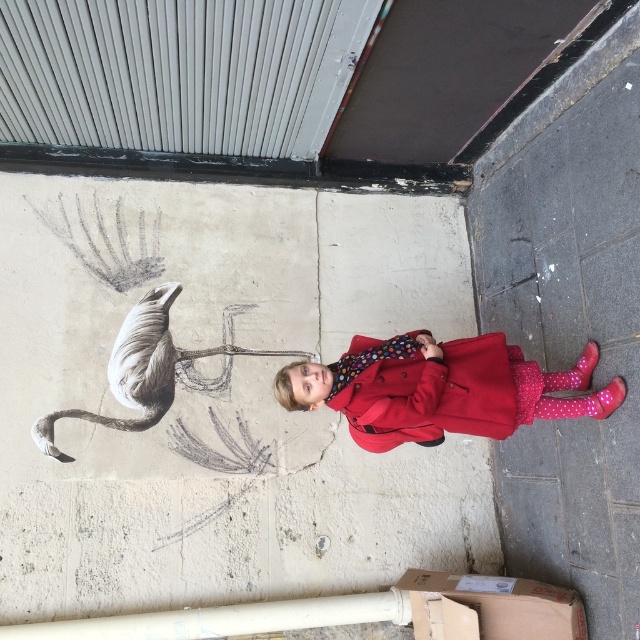
Is point (540, 355) more distant than point (330, 378)?

Yes, point (540, 355) is farther from viewer.

Is gray concrete sidewalk at lower right bigger than matte red coat at center?

Yes, gray concrete sidewalk at lower right is bigger than matte red coat at center.

Find the location of a particular element. The height and width of the screenshot is (640, 640). gray concrete sidewalk at lower right is located at coordinates (570, 321).

Measure the distance between smooth concrete wall at center and matte red coat at center.

smooth concrete wall at center and matte red coat at center are 31.65 inches apart from each other.

Does smooth concrete wall at center have a larger size compared to matte red coat at center?

Correct, smooth concrete wall at center is larger in size than matte red coat at center.

Which is behind, point (28, 250) or point (352, 360)?

Positioned behind is point (28, 250).

Locate an element on the screen. Image resolution: width=640 pixels, height=640 pixels. smooth concrete wall at center is located at coordinates (220, 397).

Between smooth concrete wall at center and gray concrete sidewalk at lower right, which one appears on the right side from the viewer's perspective?

Positioned to the right is gray concrete sidewalk at lower right.

Does point (365, 454) lie behind point (632, 225)?

That is True.

You are a GUI agent. You are given a task and a screenshot of the screen. Output one action in this format:
    pyautogui.click(x=<x>, y=<y>)
    Task: Click on the smooth concrete wall at center
    Image resolution: width=640 pixels, height=640 pixels.
    Given the screenshot: What is the action you would take?
    pyautogui.click(x=220, y=397)